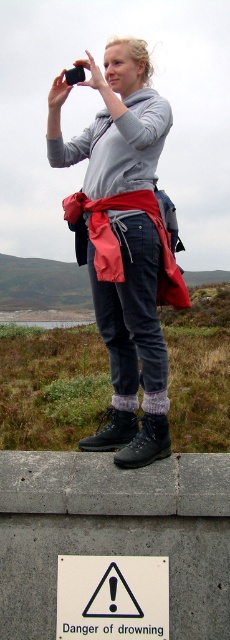
Question: Does gray concrete at upper center come behind matte gray hoodie at center?

Choices:
 (A) yes
 (B) no

Answer: (B)

Question: Which object appears farthest from the camera in this image?

Choices:
 (A) matte gray hoodie at center
 (B) gray concrete at upper center

Answer: (A)

Question: Which of the following is the farthest from the observer?

Choices:
 (A) (175, 480)
 (B) (94, 636)

Answer: (A)

Question: Among these points, which one is farthest from the camera?

Choices:
 (A) (129, 573)
 (B) (108, 234)
 (C) (40, 547)

Answer: (B)

Question: Does gray concrete at upper center appear over matte gray hoodie at center?

Choices:
 (A) yes
 (B) no

Answer: (B)

Question: Does matte gray hoodie at center have a lesser width compared to white plastic sign at lower center?

Choices:
 (A) yes
 (B) no

Answer: (B)